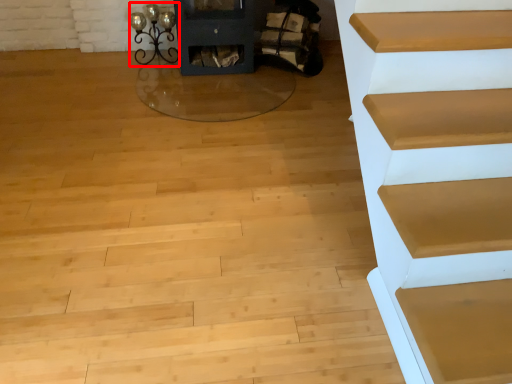
Question: From the image's perspective, considering the relative positions of light (annotated by the red box) and chair in the image provided, where is light (annotated by the red box) located with respect to the staircase?

Choices:
 (A) below
 (B) above

Answer: (A)